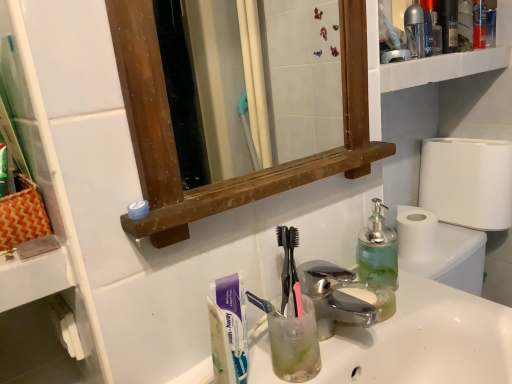
What do you see at coordinates (426, 340) in the screenshot? I see `white glossy sink at center` at bounding box center [426, 340].

Where is `green translucent soap dispenser at right, which appears as the second bottle when viewed from the back`? green translucent soap dispenser at right, which appears as the second bottle when viewed from the back is located at coordinates (378, 250).

The height and width of the screenshot is (384, 512). What do you see at coordinates (234, 319) in the screenshot?
I see `white matte toothpaste at lower left` at bounding box center [234, 319].

You are a GUI agent. You are given a task and a screenshot of the screen. Output one action in this format:
    pyautogui.click(x=<x>, y=<y>)
    Task: Click on the white glossy sink at center
    The height and width of the screenshot is (384, 512).
    Given the screenshot: What is the action you would take?
    pyautogui.click(x=426, y=340)

Is there a large distance between transparent plastic bottle at upper right, positioned as the first bottle in back-to-front order, and white glossy sink at center?

No, there isn't a large distance between transparent plastic bottle at upper right, positioned as the first bottle in back-to-front order, and white glossy sink at center.

Is point (416, 53) positioned behind point (418, 323)?

That is True.

Is transparent plastic bottle at upper right, marked as the 2th bottle in a bottom-to-top arrangement, turned away from white glossy sink at center?

transparent plastic bottle at upper right, marked as the 2th bottle in a bottom-to-top arrangement, is not turned away from white glossy sink at center.

Consider the image. In terms of height, does transparent plastic bottle at upper right, positioned as the 2th bottle in front-to-back order, look taller or shorter compared to white glossy sink at center?

transparent plastic bottle at upper right, positioned as the 2th bottle in front-to-back order, is shorter than white glossy sink at center.

From the picture: Is orange woven picnic basket at left taller or shorter than white matte toothpaste at lower left?

In the image, orange woven picnic basket at left appears to be shorter than white matte toothpaste at lower left.

Can you confirm if orange woven picnic basket at left is wider than white matte toothpaste at lower left?

Yes.

Is point (31, 201) more distant than point (215, 299)?

That is False.

Is orange woven picnic basket at left with white matte toothpaste at lower left?

No, orange woven picnic basket at left is not touching white matte toothpaste at lower left.

Which object is further away from the camera, white matte toothpaste at lower left or white glossy sink at center?

white matte toothpaste at lower left is further from the camera.

Is white matte toothpaste at lower left to the left of white glossy sink at center from the viewer's perspective?

Yes, white matte toothpaste at lower left is to the left of white glossy sink at center.

Does point (242, 300) appear closer or farther from the camera than point (350, 352)?

Point (242, 300) is positioned closer to the camera compared to point (350, 352).

In terms of size, does white matte toothpaste at lower left appear bigger or smaller than white glossy sink at center?

In the image, white matte toothpaste at lower left appears to be smaller than white glossy sink at center.

From a real-world perspective, who is located lower, polished chrome faucet at center or white glossy sink at center?

white glossy sink at center.

Considering the sizes of objects polished chrome faucet at center and white glossy sink at center in the image provided, who is taller, polished chrome faucet at center or white glossy sink at center?

Standing taller between the two is white glossy sink at center.

Which of these two, polished chrome faucet at center or white glossy sink at center, is wider?

white glossy sink at center.

Is polished chrome faucet at center facing towards white glossy sink at center?

No, polished chrome faucet at center is not turned towards white glossy sink at center.

Is white matte toothpaste at lower left thinner than polished chrome faucet at center?

Correct, the width of white matte toothpaste at lower left is less than that of polished chrome faucet at center.

What are the coordinates of `toothpaste above the polished chrome faucet at center (from the image's perspective)` in the screenshot? It's located at (234, 319).

Is white matte toothpaste at lower left positioned beyond the bounds of polished chrome faucet at center?

Yes, white matte toothpaste at lower left is located beyond the bounds of polished chrome faucet at center.

Does white matte toothpaste at lower left have a larger size compared to polished chrome faucet at center?

Incorrect, white matte toothpaste at lower left is not larger than polished chrome faucet at center.

In the scene shown: Which is closer, (415, 280) or (456, 177)?

The point (415, 280) is in front.

Is white glossy sink at center facing away from white paper toilet roll at right?

No, white glossy sink at center is not facing the opposite direction of white paper toilet roll at right.

Which of these two, white glossy sink at center or white paper toilet roll at right, stands shorter?

Standing shorter between the two is white glossy sink at center.

Considering the sizes of objects white paper toilet roll at right and green translucent soap dispenser at right, positioned as the second bottle in right-to-left order, in the image provided, who is bigger, white paper toilet roll at right or green translucent soap dispenser at right, positioned as the second bottle in right-to-left order,?

white paper toilet roll at right.

Is white paper toilet roll at right facing towards green translucent soap dispenser at right, positioned as the second bottle in right-to-left order?

No.

Looking at their sizes, would you say white paper toilet roll at right is wider or thinner than green translucent soap dispenser at right, which appears as the second bottle when viewed from the back?

Clearly, white paper toilet roll at right has more width compared to green translucent soap dispenser at right, which appears as the second bottle when viewed from the back.

In order to click on sink below the transparent plastic bottle at upper right, arranged as the 1th bottle when viewed from the right (from the image's perspective) in this screenshot , I will do `click(426, 340)`.

You are a GUI agent. You are given a task and a screenshot of the screen. Output one action in this format:
    pyautogui.click(x=<x>, y=<y>)
    Task: Click on the picnic basket above the white matte toothpaste at lower left (from the image's perspective)
    The width and height of the screenshot is (512, 384).
    Given the screenshot: What is the action you would take?
    pyautogui.click(x=22, y=215)

Based on their spatial positions, is polished chrome faucet at center or white matte toothpaste at lower left further from transparent plastic bottle at upper right, placed as the 1th bottle when sorted from top to bottom?

Among the two, white matte toothpaste at lower left is located further to transparent plastic bottle at upper right, placed as the 1th bottle when sorted from top to bottom.

Which object lies nearer to the anchor point white glossy sink at center, transparent plastic bottle at upper right, placed as the 1th bottle when sorted from top to bottom, or polished chrome faucet at center?

polished chrome faucet at center lies closer to white glossy sink at center than the other object.

Consider the image. From the image, which object appears to be nearer to polished chrome faucet at center, white glossy sink at center or orange woven picnic basket at left?

The object closer to polished chrome faucet at center is white glossy sink at center.

Estimate the real-world distances between objects in this image. Which object is closer to green translucent soap dispenser at right, which appears as the second bottle when viewed from the back, white glossy sink at center or polished chrome faucet at center?

Based on the image, polished chrome faucet at center appears to be nearer to green translucent soap dispenser at right, which appears as the second bottle when viewed from the back.

Looking at the image, which one is located further to transparent plastic bottle at upper right, positioned as the 2th bottle in front-to-back order, white glossy sink at center or polished chrome faucet at center?

white glossy sink at center is positioned further to the anchor transparent plastic bottle at upper right, positioned as the 2th bottle in front-to-back order.

Consider the image. Which object lies further to the anchor point transparent plastic bottle at upper right, arranged as the 1th bottle when viewed from the right, green translucent soap dispenser at right, the second bottle viewed from the top, or polished chrome faucet at center?

polished chrome faucet at center is positioned further to the anchor transparent plastic bottle at upper right, arranged as the 1th bottle when viewed from the right.

Considering their positions, is white matte toothpaste at lower left positioned further to polished chrome faucet at center than transparent plastic bottle at upper right, positioned as the first bottle in back-to-front order?

Among the two, transparent plastic bottle at upper right, positioned as the first bottle in back-to-front order, is located further to polished chrome faucet at center.

Estimate the real-world distances between objects in this image. Which object is further from white paper toilet roll at right, orange woven picnic basket at left or white glossy sink at center?

The object further to white paper toilet roll at right is orange woven picnic basket at left.

This screenshot has width=512, height=384. Find the location of `toothpaste situated between orange woven picnic basket at left and white paper toilet roll at right from left to right`. toothpaste situated between orange woven picnic basket at left and white paper toilet roll at right from left to right is located at coordinates (234, 319).

Where is `faucet between white glossy sink at center and green translucent soap dispenser at right, which appears as the second bottle when viewed from the back, in the front-back direction`? The width and height of the screenshot is (512, 384). faucet between white glossy sink at center and green translucent soap dispenser at right, which appears as the second bottle when viewed from the back, in the front-back direction is located at coordinates (333, 297).

The height and width of the screenshot is (384, 512). I want to click on sink situated between orange woven picnic basket at left and transparent plastic bottle at upper right, positioned as the 2th bottle in front-to-back order, from left to right, so click(426, 340).

Where is `bottle between transparent plastic bottle at upper right, positioned as the first bottle in back-to-front order, and white glossy sink at center, in the vertical direction`? The image size is (512, 384). bottle between transparent plastic bottle at upper right, positioned as the first bottle in back-to-front order, and white glossy sink at center, in the vertical direction is located at coordinates (378, 250).